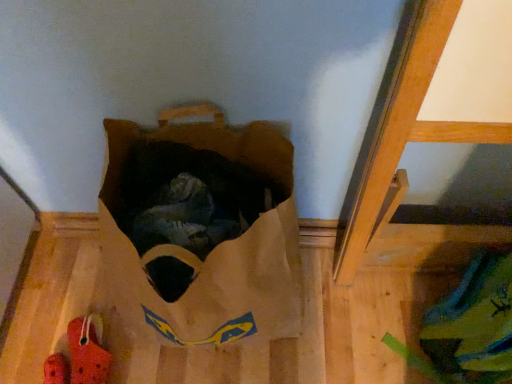
This screenshot has width=512, height=384. I want to click on vacant space to the right of brown paper bag at upper center, so click(x=350, y=312).